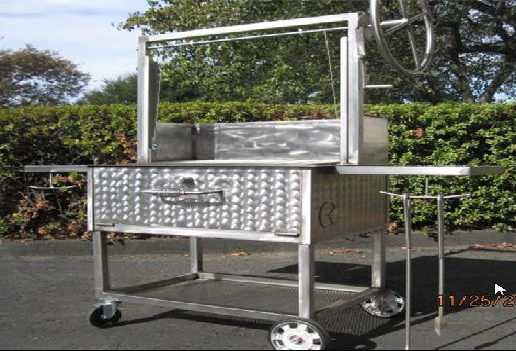
Find the location of a particular element. The height and width of the screenshot is (351, 516). metal cart is located at coordinates (275, 192), (294, 159), (375, 169), (272, 295), (77, 165), (331, 16).